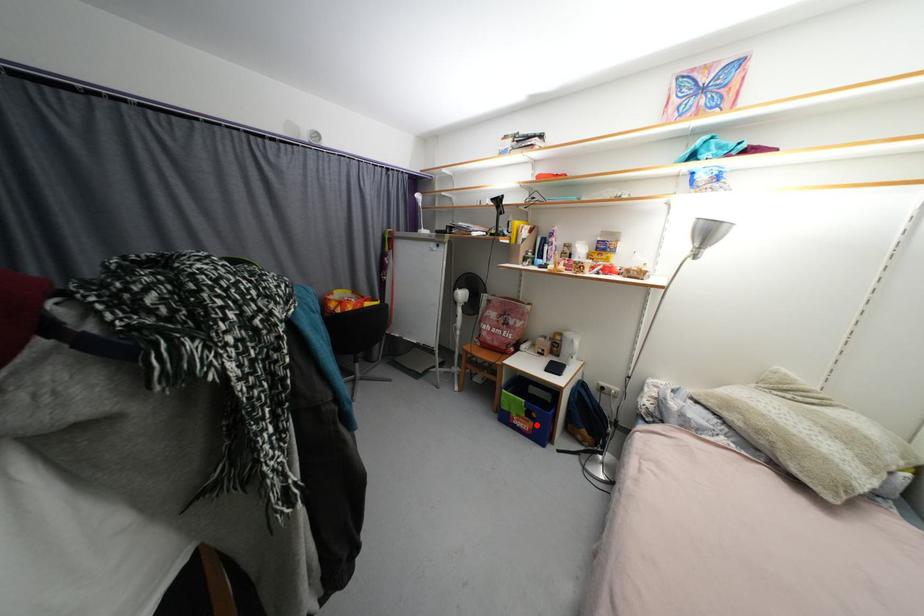
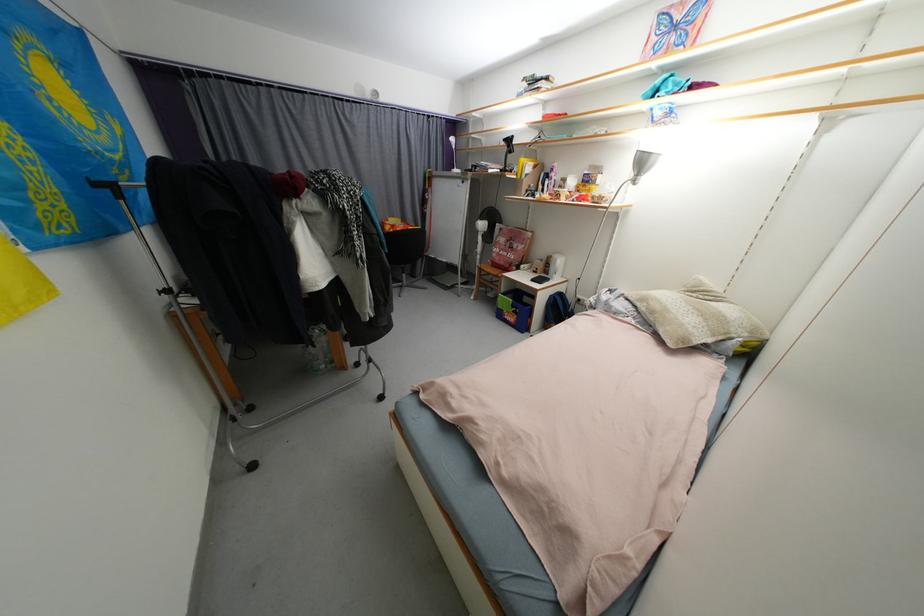
Find the pixel in the second image that matches the highlighted location in the first image.

(520, 318)